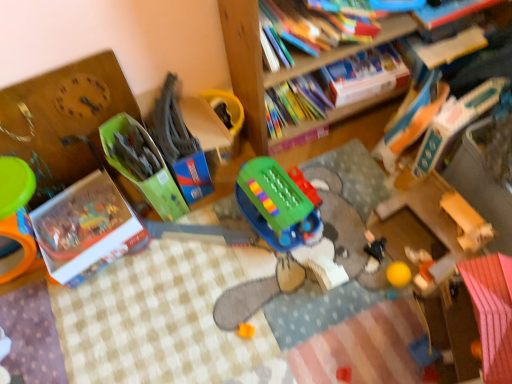
At what (x,y) coordinates should I click in order to perform the action: click on vacant area that is in front of wooden bookcase at upper center. Please return your answer as a coordinate pair (x, y). This screenshot has width=512, height=384. Looking at the image, I should click on (324, 253).